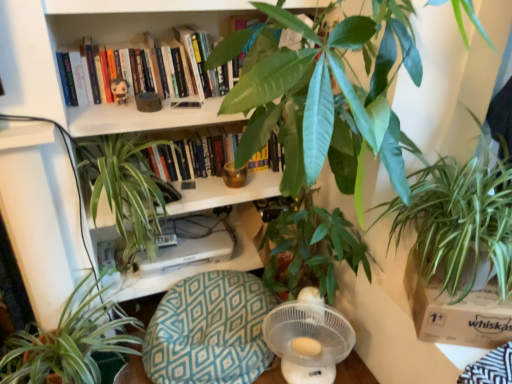
Question: Considering their positions, is green leafy plant at center, the second houseplant from the left, located in front of or behind plush toy at upper center?

Choices:
 (A) behind
 (B) front

Answer: (B)

Question: In terms of width, does green leafy plant at center, the 3th houseplant in the right-to-left sequence, look wider or thinner when compared to plush toy at upper center?

Choices:
 (A) thin
 (B) wide

Answer: (B)

Question: Based on their relative distances, which object is nearer to the white plastic fan at lower center?

Choices:
 (A) hardcover book at upper center
 (B) green leafy plant at lower left, arranged as the first houseplant when viewed from the left
 (C) green leafy plant at center, which is counted as the third houseplant, starting from the left
 (D) white cardboard box at lower right
 (E) green leafy plant at right, which is the fourth houseplant in left-to-right order

Answer: (D)

Question: Considering the real-world distances, which object is farthest from the hardcover book at upper center?

Choices:
 (A) white plastic fan at lower center
 (B) green leafy plant at center, the second houseplant from the left
 (C) plush toy at upper center
 (D) green leafy plant at right, the 1th houseplant when ordered from right to left
 (E) white cardboard box at lower right

Answer: (E)